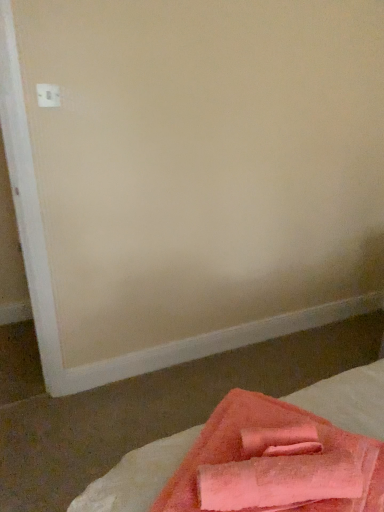
Question: Based on their sizes in the image, would you say soft pink towel at lower right is bigger or smaller than white plastic electric outlet at upper left?

Choices:
 (A) big
 (B) small

Answer: (A)

Question: Considering the positions of soft pink towel at lower right and white plastic electric outlet at upper left in the image, is soft pink towel at lower right taller or shorter than white plastic electric outlet at upper left?

Choices:
 (A) tall
 (B) short

Answer: (A)

Question: Which is nearer to the pink terry cloth towel at lower right?

Choices:
 (A) white plastic electric outlet at upper left
 (B) soft pink towel at lower right

Answer: (B)

Question: Which object is the closest to the soft pink towel at lower right?

Choices:
 (A) white plastic electric outlet at upper left
 (B) pink terry cloth towel at lower right

Answer: (B)